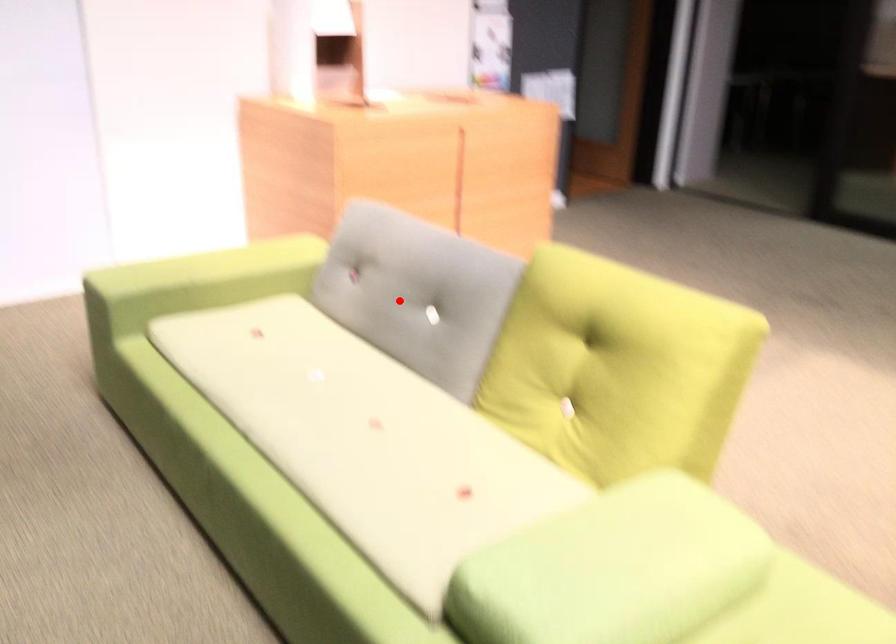
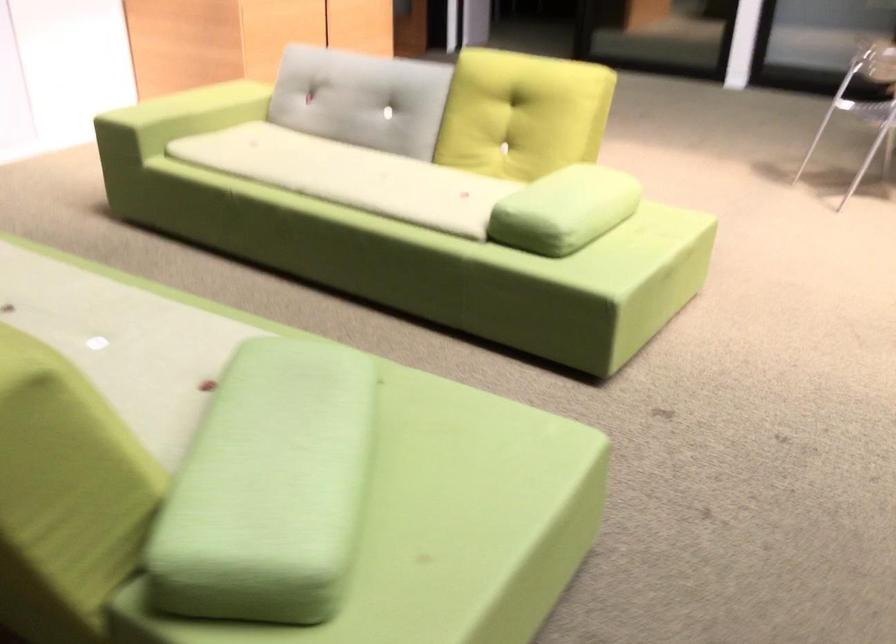
Question: I am providing you with two images of the same scene from different viewpoints. Image1 has a red point marked. In image2, the corresponding 3D location appears at what relative position? Reply with the corresponding letter.

Choices:
 (A) Closer
 (B) Farther

Answer: (B)